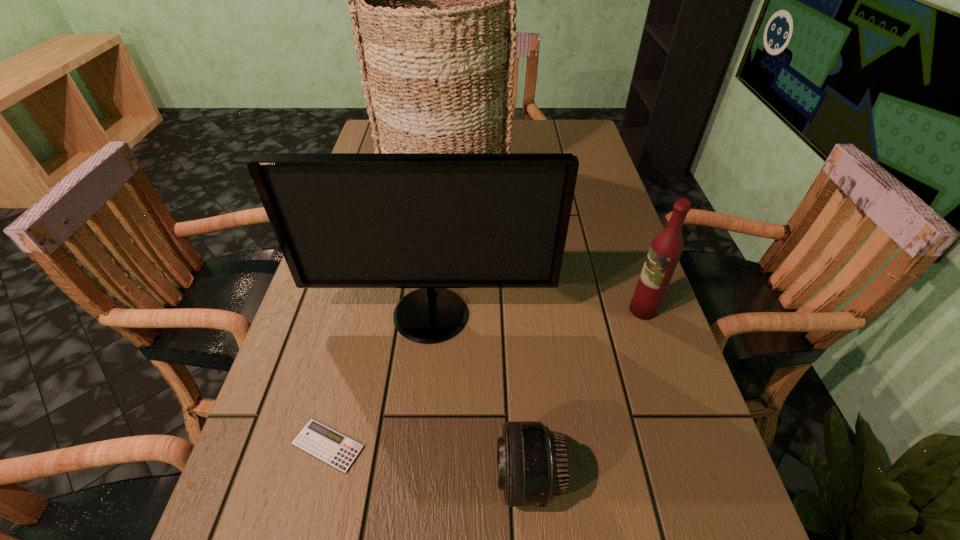
Locate an element on the screen. The image size is (960, 540). free spot located 0.390m on the label of the rightmost object is located at coordinates (452, 310).

You are a GUI agent. You are given a task and a screenshot of the screen. Output one action in this format:
    pyautogui.click(x=<x>, y=<y>)
    Task: Click on the blank area located on the label of the rightmost object
    
    Given the screenshot: What is the action you would take?
    pyautogui.click(x=547, y=310)

This screenshot has width=960, height=540. What are the coordinates of `blank space located on the front-facing side of the telephoto lens` in the screenshot? It's located at (275, 478).

You are a GUI agent. You are given a task and a screenshot of the screen. Output one action in this format:
    pyautogui.click(x=<x>, y=<y>)
    Task: Click on the vacant area situated 0.330m on the front-facing side of the telephoto lens
    This screenshot has height=540, width=960.
    Given the screenshot: What is the action you would take?
    pyautogui.click(x=293, y=478)

This screenshot has height=540, width=960. Identify the location of vacant space located 0.090m on the front-facing side of the telephoto lens. (442, 478).

Find the location of a particular element. This screenshot has height=540, width=960. free space located 0.220m on the back of the calculator is located at coordinates (358, 323).

The image size is (960, 540). Identify the location of object located in the far edge section of the desktop. (433, 0).

The height and width of the screenshot is (540, 960). In order to click on basket present at the left edge in this screenshot , I will do `click(433, 0)`.

Locate an element on the screen. computer monitor that is at the left edge is located at coordinates (432, 221).

Locate an element on the screen. The width and height of the screenshot is (960, 540). calculator located at the left edge is located at coordinates (328, 445).